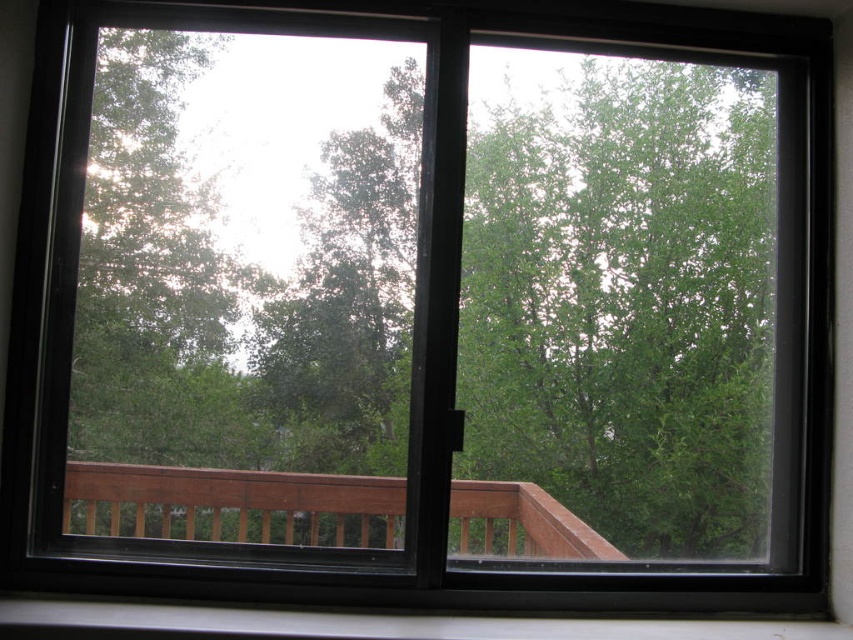
You are trying to hang a small bird feeder from the brown wooden rail at center and the white plastic window sill at lower center. Which object can you hang it from if the hook requires at least 10 cm of vertical space?

The brown wooden rail at center is much taller than the white plastic window sill at lower center, so it can provide the required vertical space for hanging the bird feeder.

You are designing a new window frame and need to know the relative thickness of the brown wooden rail at center and the white plastic window sill at lower center. Which one is thinner?

The brown wooden rail at center is thinner than the white plastic window sill at lower center.